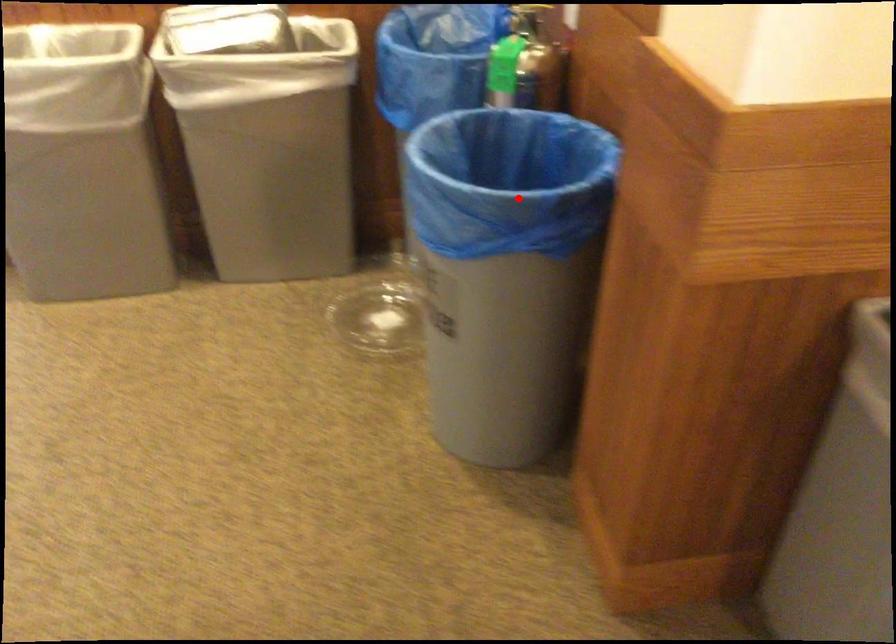
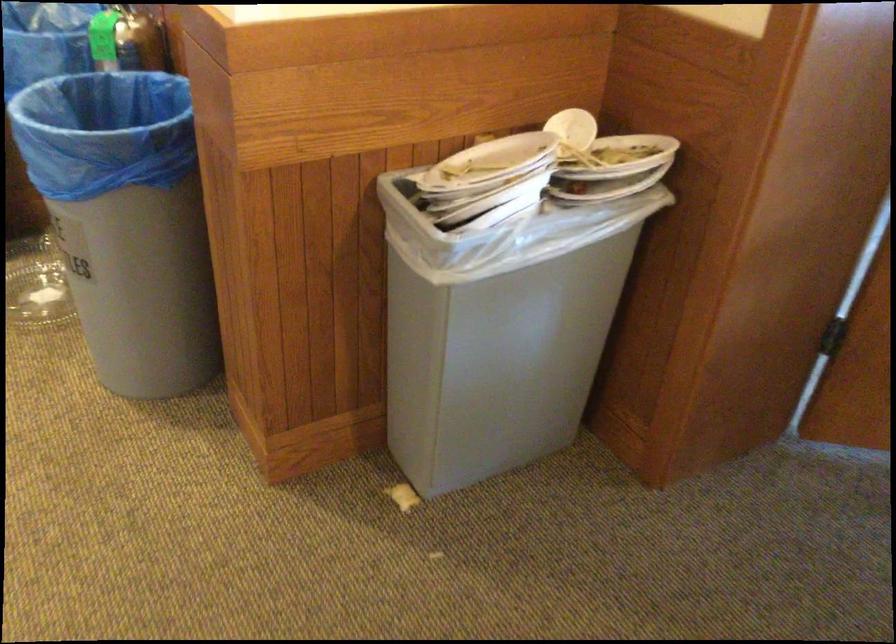
Question: I am providing you with two images of the same scene from different viewpoints. Given a red point in image1, look at the same physical point in image2. Is it:

Choices:
 (A) Closer to the viewpoint
 (B) Farther from the viewpoint

Answer: (B)